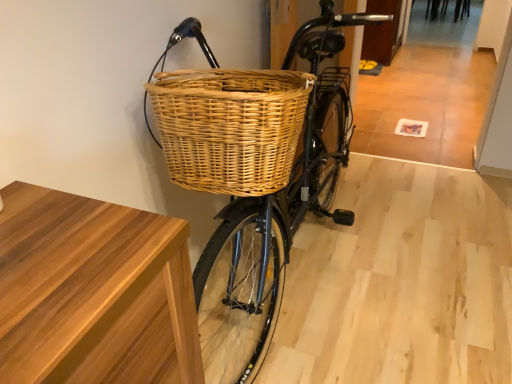
Measure the distance between point (303, 33) and camera.

Point (303, 33) and camera are 1.17 meters apart from each other.

Describe the element at coordinates (270, 234) in the screenshot. The image size is (512, 384). I see `woven wood basket at center` at that location.

This screenshot has height=384, width=512. I want to click on woven wood basket at center, so click(x=270, y=234).

Where is `woven wood basket at center`? The height and width of the screenshot is (384, 512). woven wood basket at center is located at coordinates (270, 234).